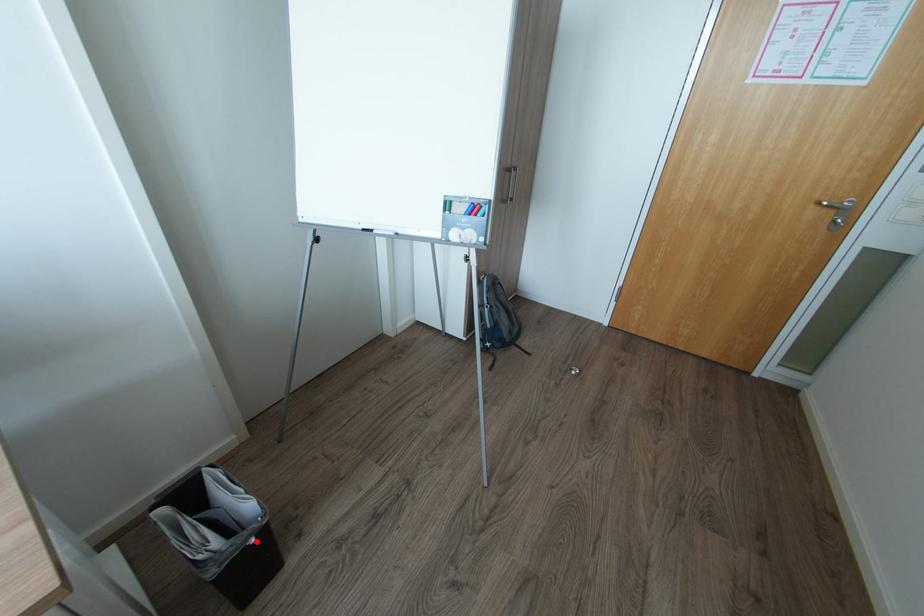
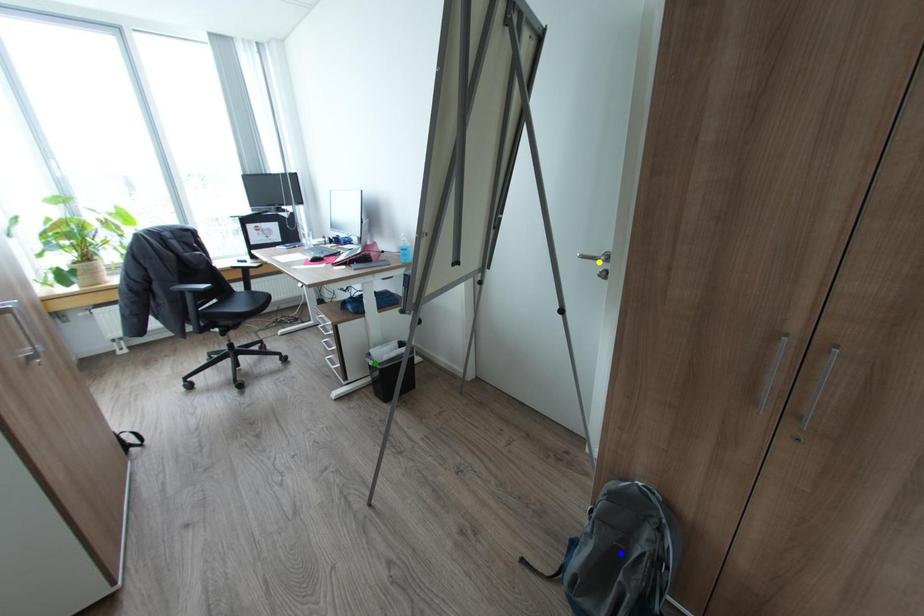
Question: I am providing you with two images of the same scene from different viewpoints. A red point is marked on the first image. You are given multiple points on the second image. Which spot in image 2 lines up with the point in image 1?

Choices:
 (A) green point
 (B) blue point
 (C) yellow point

Answer: (A)